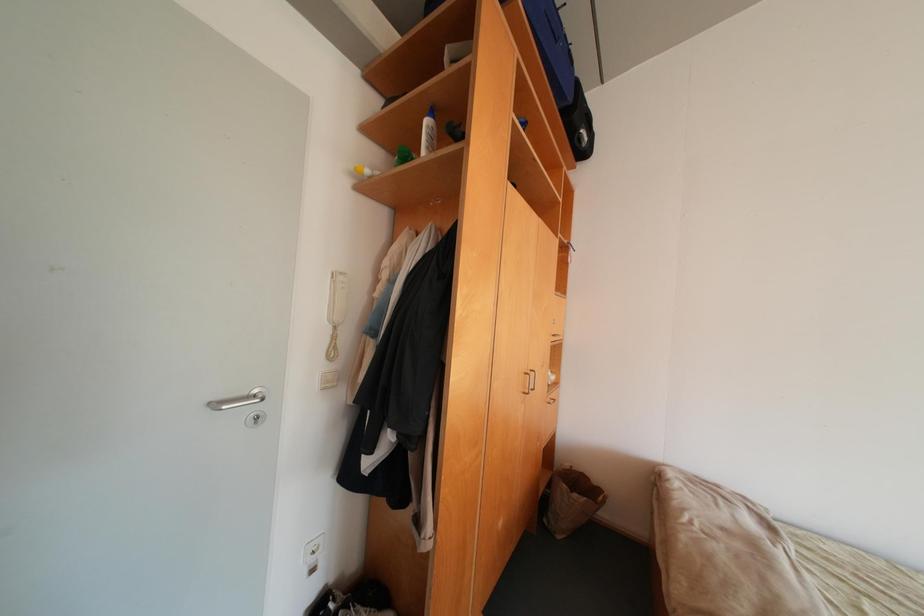
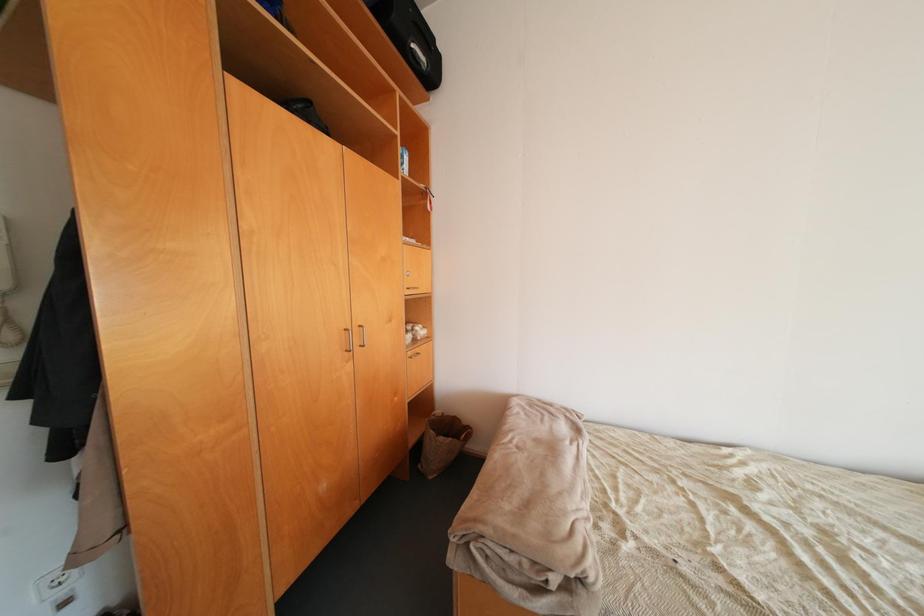
Question: In a continuous first-person perspective shot, in which direction is the camera moving?

Choices:
 (A) Left
 (B) Right
 (C) Forward
 (D) Backward

Answer: (B)